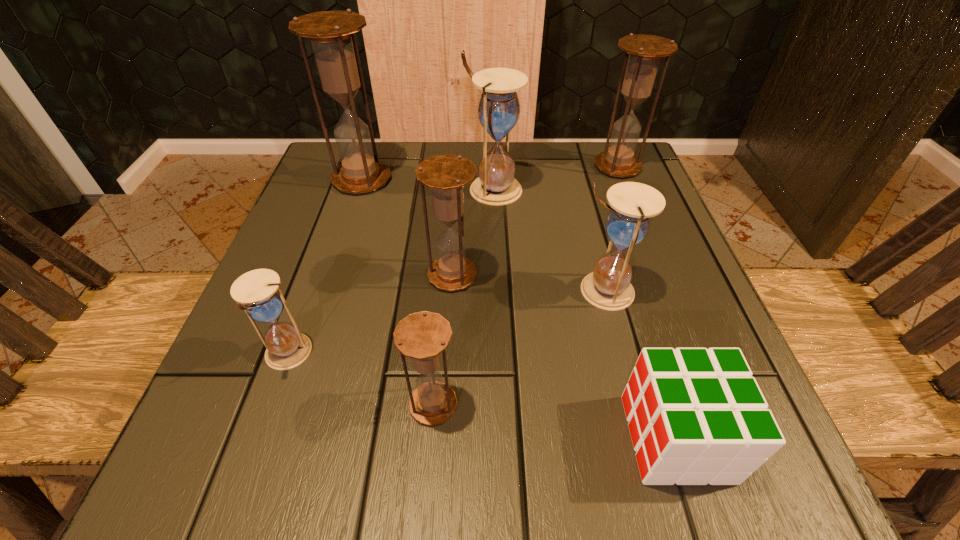
Identify the location of the second closest white hourglass to the second white hourglass from left to right. (257, 292).

This screenshot has width=960, height=540. What are the coordinates of `white hourglass that is the closest one to the third biggest brown hourglass` in the screenshot? It's located at (498, 111).

Image resolution: width=960 pixels, height=540 pixels. Find the location of `free point that satisfies the following two spatial constraints: 1. on the back side of the second white hourglass from left to right; 2. on the right side of the nearest hourglass`. free point that satisfies the following two spatial constraints: 1. on the back side of the second white hourglass from left to right; 2. on the right side of the nearest hourglass is located at coordinates (450, 190).

The width and height of the screenshot is (960, 540). I want to click on free space that satisfies the following two spatial constraints: 1. on the back side of the smallest white hourglass; 2. on the left side of the second smallest white hourglass, so click(310, 290).

Locate an element on the screen. free space that satisfies the following two spatial constraints: 1. on the back side of the farthest white hourglass; 2. on the left side of the nearest brown hourglass is located at coordinates (450, 190).